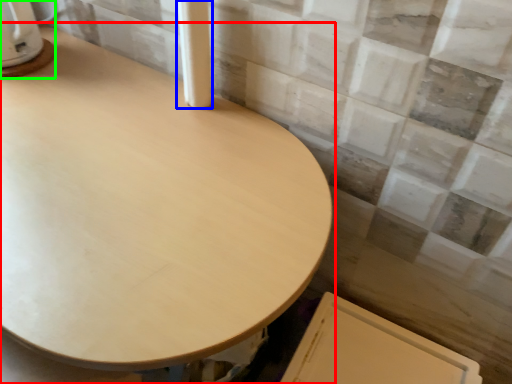
Question: Estimate the real-world distances between objects in this image. Which object is closer to table (highlighted by a red box), pillar (highlighted by a blue box) or appliance (highlighted by a green box)?

Choices:
 (A) pillar
 (B) appliance

Answer: (A)